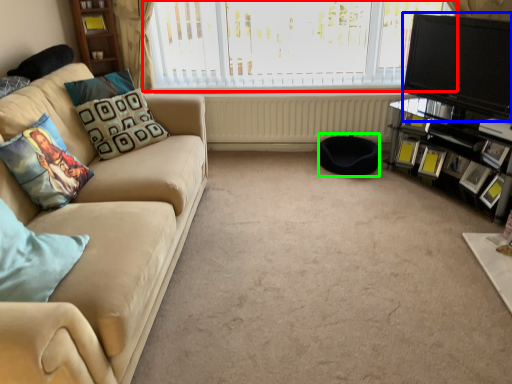
Question: Based on their relative distances, which object is farther from window (highlighted by a red box)? Choose from television (highlighted by a blue box) and footrest (highlighted by a green box).

Choices:
 (A) television
 (B) footrest

Answer: (B)